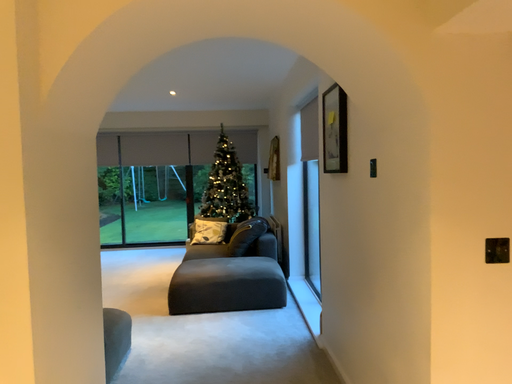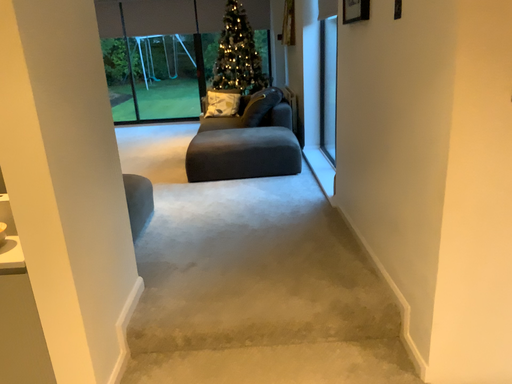
Question: How did the camera likely rotate when shooting the video?

Choices:
 (A) rotated upward
 (B) rotated downward

Answer: (B)